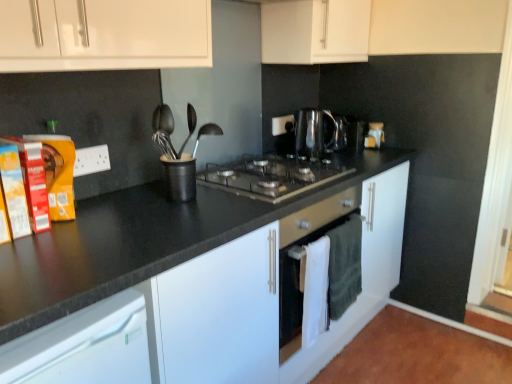
Identify the location of blank space situated above black granite countertop at center (from a real-world perspective). The image size is (512, 384). (209, 194).